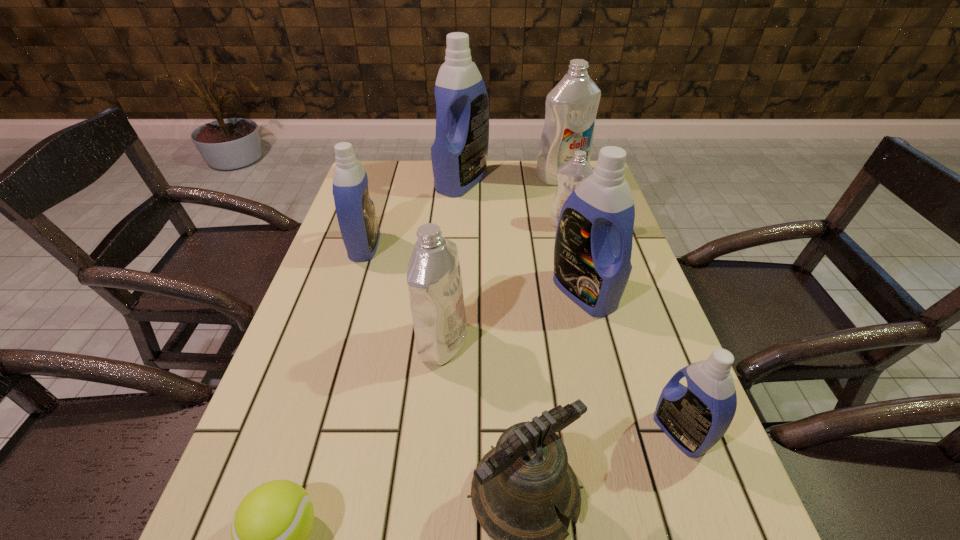
Find the location of a particular element. the third blue detergent from right to left is located at coordinates (459, 154).

This screenshot has width=960, height=540. Find the location of `the farthest blue detergent`. the farthest blue detergent is located at coordinates (459, 154).

Identify the location of the biggest white detergent. This screenshot has height=540, width=960. 571,106.

At what (x,y) coordinates should I click in order to perform the action: click on the third farthest blue detergent. Please return your answer as a coordinate pair (x, y). This screenshot has width=960, height=540. Looking at the image, I should click on (593, 244).

Find the location of a particular element. the second smallest white detergent is located at coordinates [434, 279].

Locate an element on the screen. This screenshot has height=540, width=960. the nearest white detergent is located at coordinates (434, 279).

This screenshot has width=960, height=540. Find the location of `the leftmost blue detergent`. the leftmost blue detergent is located at coordinates point(356,215).

This screenshot has height=540, width=960. I want to click on the leftmost detergent, so click(x=356, y=215).

Identify the location of the second farthest white detergent. (572, 173).

Locate an element on the screen. Image resolution: width=960 pixels, height=540 pixels. the nearest detergent is located at coordinates (695, 418).